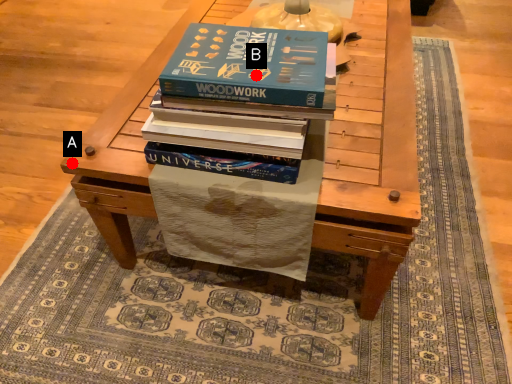
Question: Two points are circled on the image, labeled by A and B beside each circle. Which of the following is the farthest from the observer?

Choices:
 (A) A is further
 (B) B is further

Answer: (A)